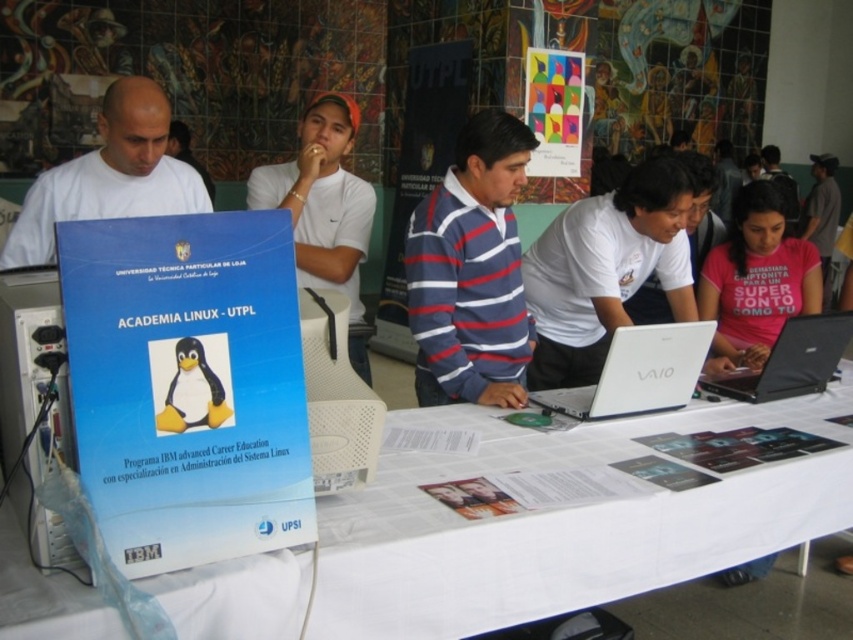
The width and height of the screenshot is (853, 640). I want to click on white paper at center, so click(573, 528).

Where is `white paper at center`? The width and height of the screenshot is (853, 640). white paper at center is located at coordinates (573, 528).

Does white matte shirt at upper left appear on the right side of colorful paper poster at upper center?

Incorrect, white matte shirt at upper left is not on the right side of colorful paper poster at upper center.

Is white matte shirt at upper left closer to camera compared to colorful paper poster at upper center?

Yes.

At what (x,y) coordinates should I click in order to perform the action: click on white matte shirt at upper left. Please return your answer as a coordinate pair (x, y). Looking at the image, I should click on (109, 176).

Does blue striped shirt at center appear under white plastic computer tower at center?

Actually, blue striped shirt at center is above white plastic computer tower at center.

Consider the image. Measure the distance between point (467,260) and camera.

Point (467,260) and camera are 2.32 meters apart from each other.

Find the location of a particular element. The height and width of the screenshot is (640, 853). blue striped shirt at center is located at coordinates (471, 269).